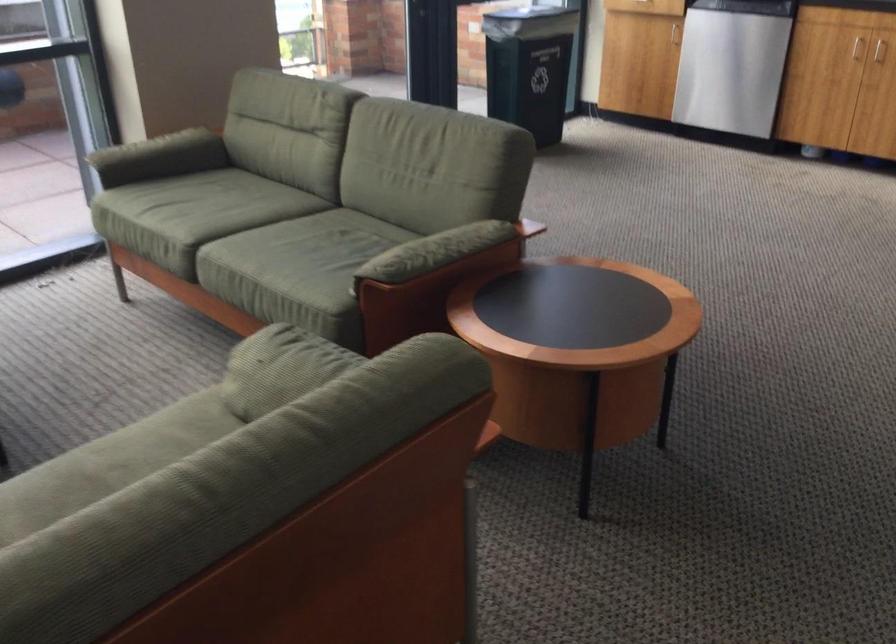
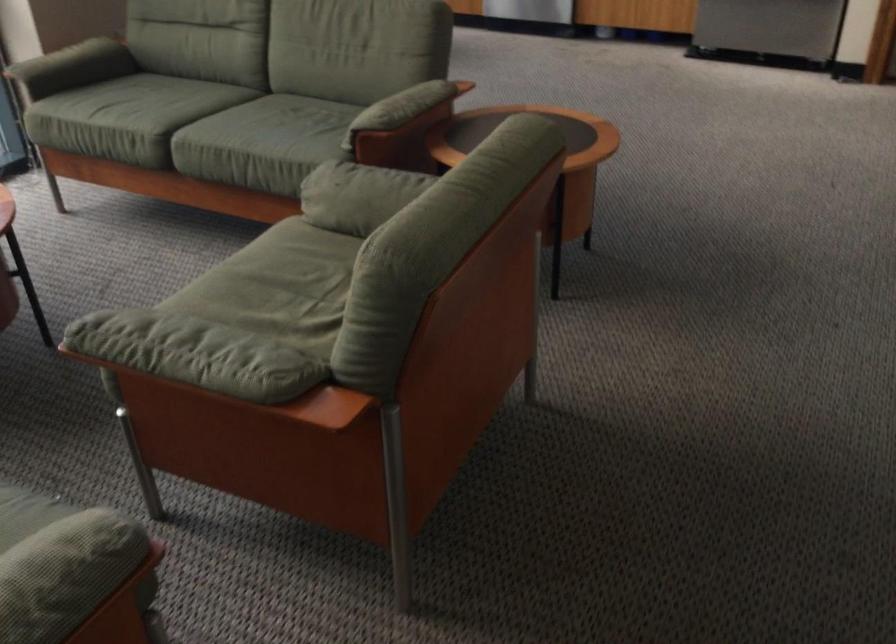
Where in the second image is the point corresponding to point 298,257 from the first image?

(271, 131)